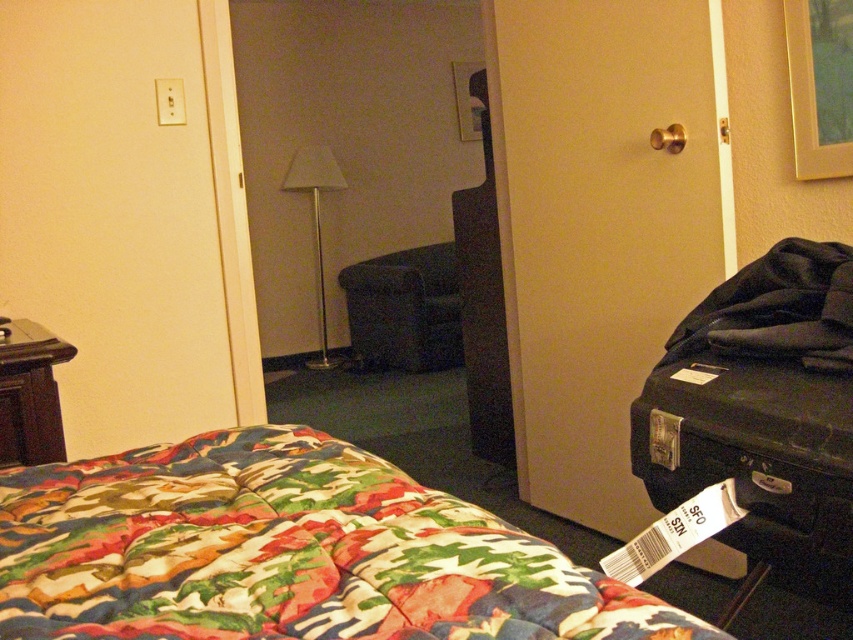
You are standing in the hotel room and want to locate the camo patterned blanket. Which object from the list corresponds to its location? The objects are point (287, 552).

The camo patterned blanket is located at point (287, 552).

You are a hotel guest who just arrived and wants to place a 2.5 meter long decorative item between the brown wood dresser at left and the wooden picture frame at upper center. Is there enough space to fit it without moving either object?

The distance between the brown wood dresser at left and the wooden picture frame at upper center is 4.66 meters. Since the decorative item is 2.5 meters long, there is sufficient space to place it between them without moving either object.

You are a guest in this hotel room and want to place a small decorative item on the wooden picture frame at upper center. However, you need to retrieve it from the brown wood dresser at left. Is the dresser below the frame, making it easy to reach the item without moving furniture?

→ The brown wood dresser at left is located below the wooden picture frame at upper center, so yes, the dresser is positioned directly underneath the frame. This means you can easily reach the item from the dresser to the frame without needing to move any furniture.